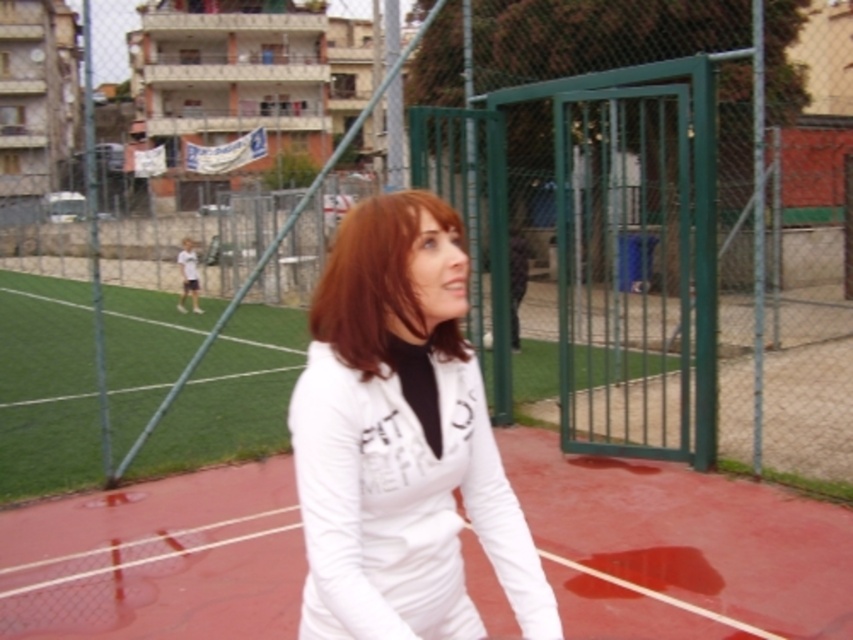
You are standing on the sports court and want to walk from point (480, 561) to point (396, 259). Which direction should you move to get closer to your destination?

To move from point (480, 561) to point (396, 259), you should move towards the direction away from the viewer since point (396, 259) is further away from the viewer compared to point (480, 561).